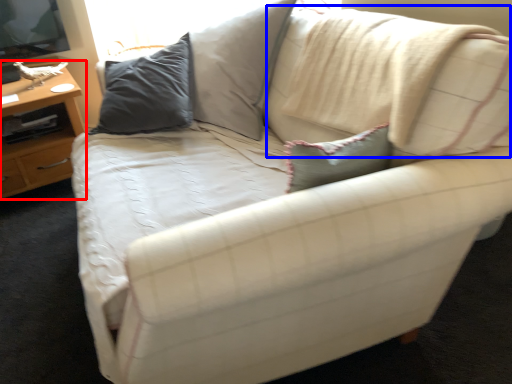
Question: Which point is further to the camera, table (highlighted by a red box) or pillow (highlighted by a blue box)?

Choices:
 (A) table
 (B) pillow

Answer: (A)